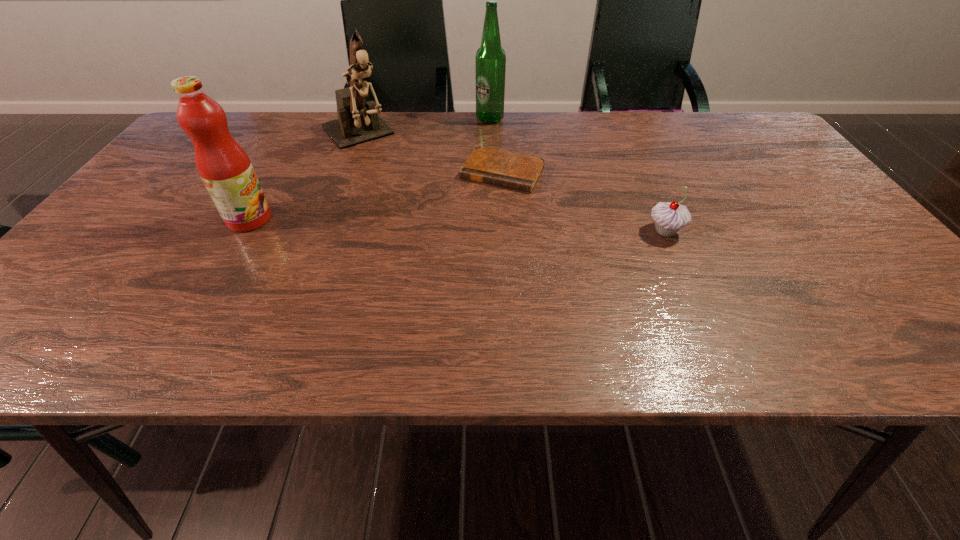
Where is `fruit juice`? The width and height of the screenshot is (960, 540). fruit juice is located at coordinates (223, 165).

The height and width of the screenshot is (540, 960). Find the location of `the second shortest object`. the second shortest object is located at coordinates (669, 218).

The width and height of the screenshot is (960, 540). Find the location of `the rightmost object`. the rightmost object is located at coordinates (669, 218).

In order to click on the shortest object in this screenshot , I will do `click(501, 168)`.

This screenshot has height=540, width=960. I want to click on figurine, so click(358, 122).

I want to click on beer bottle, so click(490, 58).

The image size is (960, 540). Identify the location of vacant space located 0.120m on the front label of the fruit juice. (324, 219).

Find the location of a particular element. The width and height of the screenshot is (960, 540). vacant region located on the left of the rightmost object is located at coordinates (568, 231).

This screenshot has width=960, height=540. In order to click on blank space located 0.350m on the spine side of the shortest object in this screenshot , I will do `click(431, 293)`.

Find the location of a particular element. The image size is (960, 540). free space located on the spine side of the shortest object is located at coordinates (457, 247).